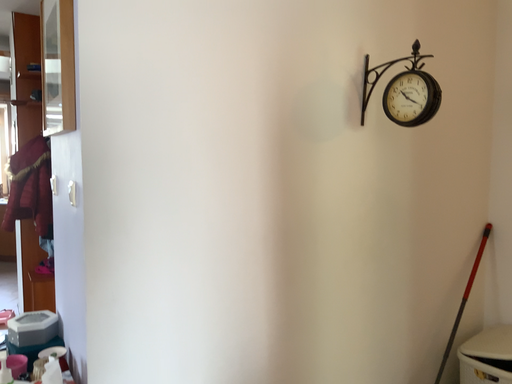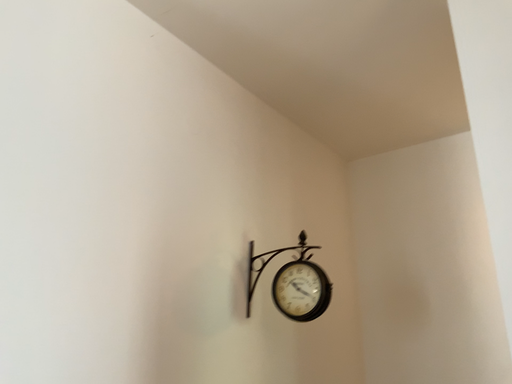
Question: Which way did the camera rotate in the video?

Choices:
 (A) rotated left
 (B) rotated right

Answer: (B)